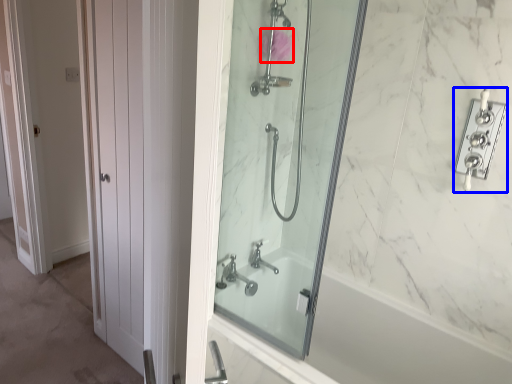
Question: Which of the following is the farthest to the observer, flower (highlighted by a red box) or lock (highlighted by a blue box)?

Choices:
 (A) flower
 (B) lock

Answer: (A)